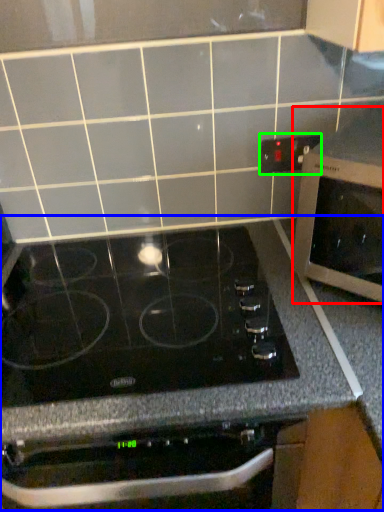
Question: Estimate the real-world distances between objects in this image. Which object is closer to microwave oven (highlighted by a red box), counter (highlighted by a blue box) or electric outlet (highlighted by a green box)?

Choices:
 (A) counter
 (B) electric outlet

Answer: (A)